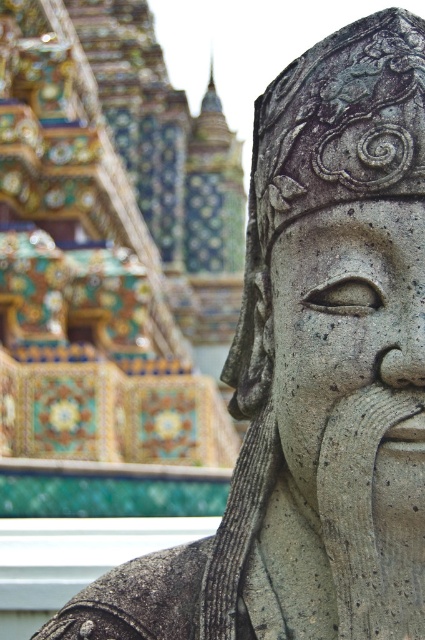
Question: Does gray stone head at center have a lesser width compared to gray stone face at center?

Choices:
 (A) no
 (B) yes

Answer: (A)

Question: Is gray stone head at center smaller than gray stone face at center?

Choices:
 (A) yes
 (B) no

Answer: (B)

Question: Among these objects, which one is nearest to the camera?

Choices:
 (A) gray stone head at center
 (B) gray stone face at center

Answer: (B)

Question: Which point appears farthest from the camera in this image?

Choices:
 (A) (317, 358)
 (B) (380, 186)

Answer: (B)

Question: Is gray stone head at center further to camera compared to gray stone face at center?

Choices:
 (A) yes
 (B) no

Answer: (A)